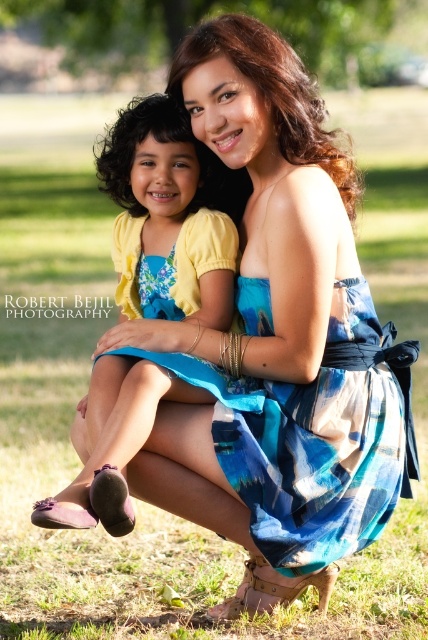
In the scene shown: You are standing in the grassy area and want to place a small picnic basket. Where should you place it so that it is directly in front of the blue plaid dress at center?

The blue plaid dress at center is located at point 0.692 on the x axis and 0.757 on the y axis, so place the picnic basket at the same coordinates to be directly in front of it.

You are a photographer trying to capture the perfect shot of the scene. You notice a specific point at coordinates (323, 442) in the image. Based on the scene description, can you identify what object or feature this point is likely pointing to?

The point at coordinates (323, 442) corresponds to the blue plaid dress at center.